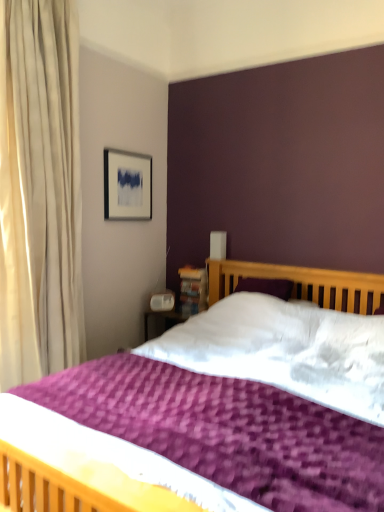
Question: In terms of size, does matte silver picture frame at upper left appear bigger or smaller than purple textured bed at center?

Choices:
 (A) big
 (B) small

Answer: (B)

Question: Relative to purple textured bed at center, is matte silver picture frame at upper left in front or behind?

Choices:
 (A) behind
 (B) front

Answer: (A)

Question: Considering the real-world distances, which object is closest to the wooden bookshelf at upper right?

Choices:
 (A) matte silver picture frame at upper left
 (B) purple textured bed at center

Answer: (A)

Question: Which object is the closest to the wooden bookshelf at upper right?

Choices:
 (A) matte silver picture frame at upper left
 (B) purple textured bed at center

Answer: (A)